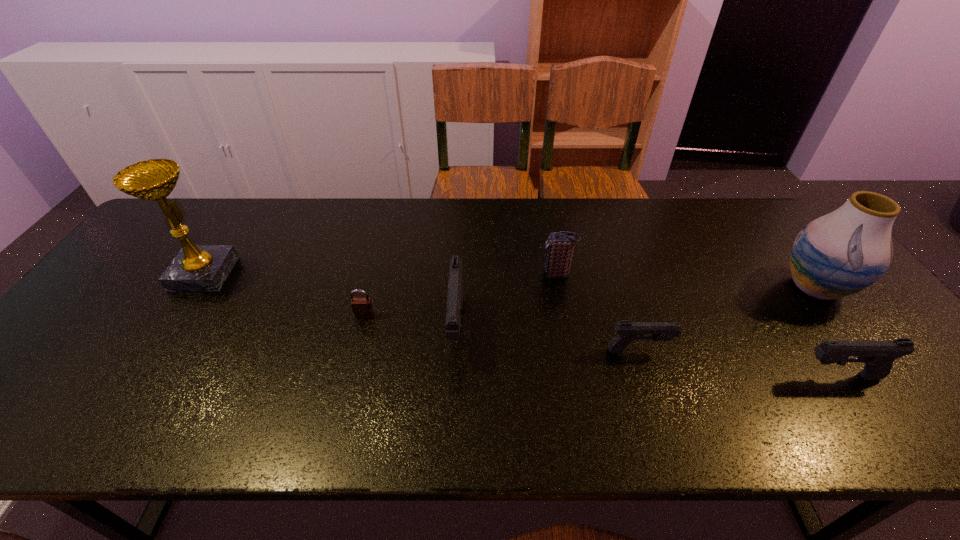
Locate an element on the screen. This screenshot has height=540, width=960. vacant area between the leftmost object and the leftmost pistol is located at coordinates (330, 301).

Locate an element on the screen. This screenshot has height=540, width=960. free area in between the shortest pistol and the vase is located at coordinates (727, 319).

What are the coordinates of `free area in between the leftmost object and the nearest pistol` in the screenshot? It's located at (522, 325).

Locate an element on the screen. This screenshot has width=960, height=540. free space that is in between the leftmost object and the leftmost pistol is located at coordinates (330, 301).

Where is `free space between the shortest pistol and the sixth shortest object`? The width and height of the screenshot is (960, 540). free space between the shortest pistol and the sixth shortest object is located at coordinates click(x=727, y=319).

Where is `vacant region between the clutch bag and the award`? The width and height of the screenshot is (960, 540). vacant region between the clutch bag and the award is located at coordinates (381, 274).

In order to click on free space between the award and the sixth object from right to left in this screenshot , I will do `click(284, 294)`.

At what (x,y) coordinates should I click in order to perform the action: click on vacant area that lies between the nearest object and the padlock. Please return your answer as a coordinate pair (x, y). The width and height of the screenshot is (960, 540). Looking at the image, I should click on (602, 346).

The height and width of the screenshot is (540, 960). In order to click on object that stands as the third closest to the fourth object from left to right in this screenshot , I will do `click(362, 308)`.

Select which object appears as the second closest to the fourth object from left to right. Please provide its 2D coordinates. Your answer should be formatted as a tuple, i.e. [(x, y)], where the tuple contains the x and y coordinates of a point satisfying the conditions above.

[(627, 331)]